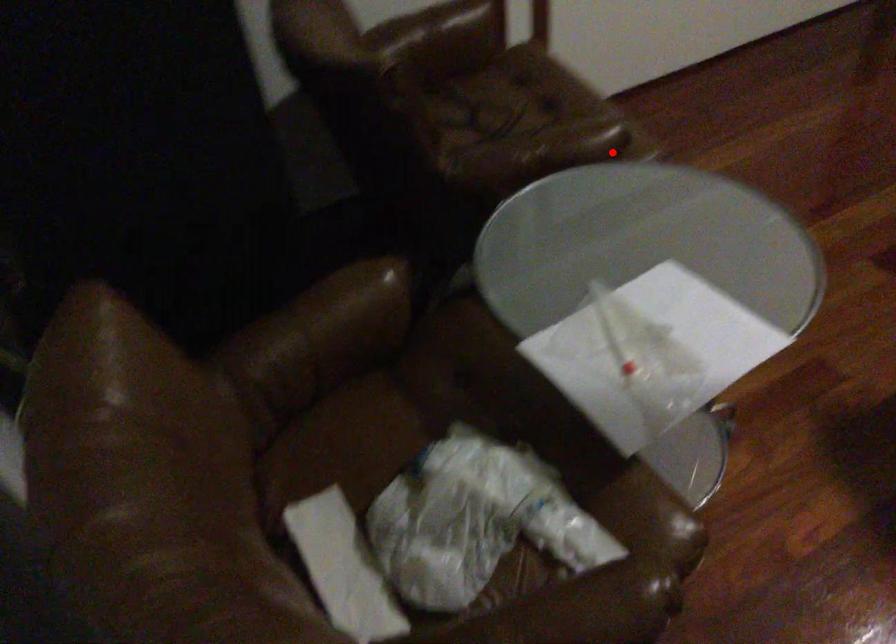
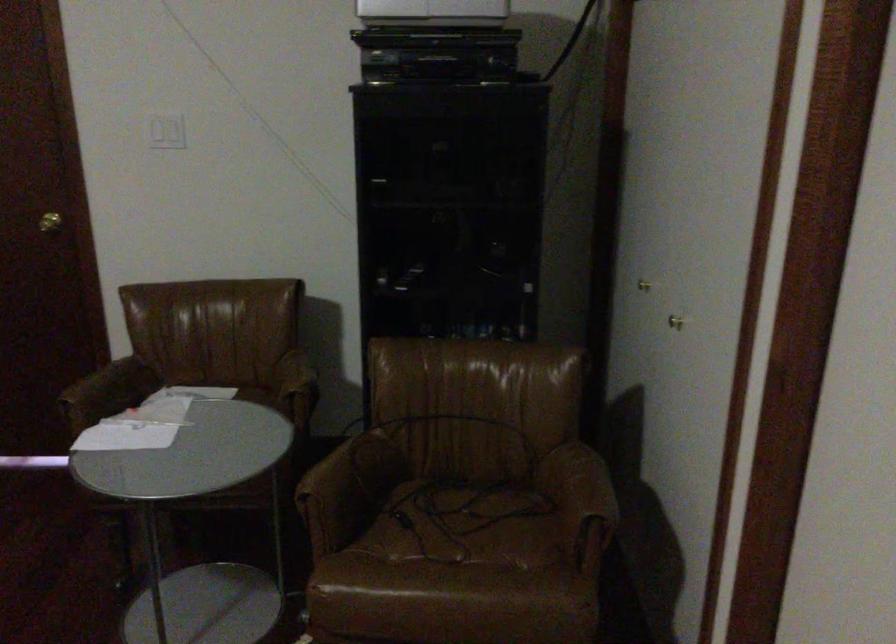
Question: A red point is marked in image1. In image2, is the corresponding 3D point closer to the camera or farther? Reply with the corresponding letter.

Choices:
 (A) The corresponding 3D point is closer.
 (B) The corresponding 3D point is farther.

Answer: (B)